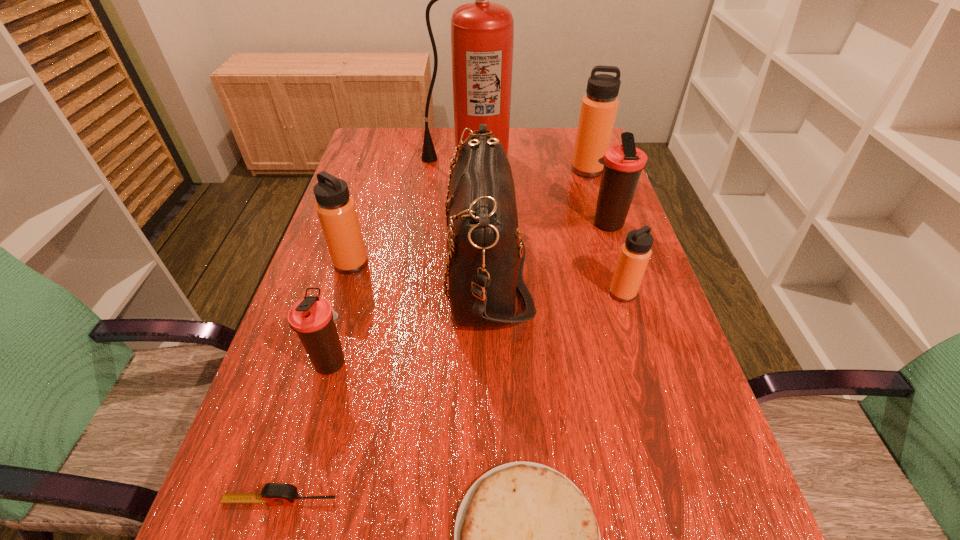
Where is `the left brown thermos bottle`? The image size is (960, 540). the left brown thermos bottle is located at coordinates (312, 318).

Identify the location of the nearest orange thermos bottle. (635, 253).

Locate an element on the screen. The image size is (960, 540). the second nearest thermos bottle is located at coordinates (635, 253).

Locate an element on the screen. This screenshot has width=960, height=540. the second shortest object is located at coordinates (274, 494).

Locate an element on the screen. The height and width of the screenshot is (540, 960). black tape measure is located at coordinates (274, 494).

Where is `vacant area situated on the instruction side of the tallest object`? vacant area situated on the instruction side of the tallest object is located at coordinates (467, 225).

You are a GUI agent. You are given a task and a screenshot of the screen. Output one action in this format:
    pyautogui.click(x=<x>, y=<y>)
    Task: Click on the free region located 0.200m on the back of the biggest orange thermos bottle
    
    Given the screenshot: What is the action you would take?
    pyautogui.click(x=575, y=131)

Identify the location of vacant position located 0.150m at the front of the handbag with chain and zipper. (380, 267).

Where is `free space located 0.170m at the front of the handbag with chain and zipper`? Image resolution: width=960 pixels, height=540 pixels. free space located 0.170m at the front of the handbag with chain and zipper is located at coordinates (372, 267).

This screenshot has width=960, height=540. Find the location of `vacant space located at the front of the handbag with chain and zipper`. vacant space located at the front of the handbag with chain and zipper is located at coordinates (367, 267).